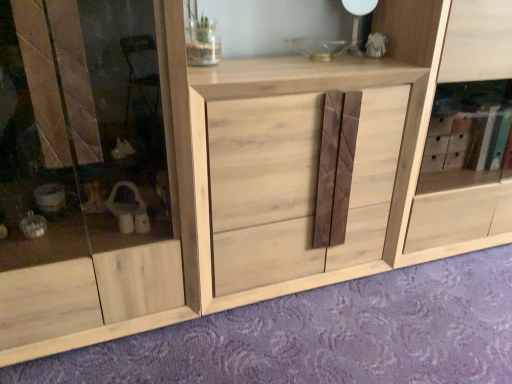
This screenshot has height=384, width=512. Identify the location of natural wood cabinet at center. (94, 177).

You are a GUI agent. You are given a task and a screenshot of the screen. Output one action in this format:
    pyautogui.click(x=<x>, y=<y>)
    Task: Click on the natural wood cabinet at center
    
    Given the screenshot: What is the action you would take?
    pyautogui.click(x=444, y=194)

This screenshot has height=384, width=512. What do you see at coordinates (294, 186) in the screenshot?
I see `natural wood drawer at center` at bounding box center [294, 186].

Where is `natural wood drawer at center`? Image resolution: width=512 pixels, height=384 pixels. natural wood drawer at center is located at coordinates (x=294, y=186).

The height and width of the screenshot is (384, 512). What are the coordinates of `natural wood cabinet at center` in the screenshot? It's located at (94, 177).

Which is more distant, [135,313] or [505,193]?

Positioned behind is point [505,193].

Who is smaller, natural wood cabinet at center or natural wood cabinet at center?

natural wood cabinet at center.

From the image's perspective, is natural wood cabinet at center on top of natural wood cabinet at center?

No, from the image's perspective, natural wood cabinet at center is not on top of natural wood cabinet at center.

Is natural wood cabinet at center turned away from natural wood cabinet at center?

natural wood cabinet at center does not have its back to natural wood cabinet at center.

Which is behind, natural wood cabinet at center or natural wood cabinet at center?

natural wood cabinet at center.

Does point (461, 203) lie in front of point (41, 259)?

No, it is not.

Is natural wood cabinet at center thinner than natural wood cabinet at center?

Correct, the width of natural wood cabinet at center is less than that of natural wood cabinet at center.

How many degrees apart are the facing directions of natural wood cabinet at center and natural wood cabinet at center?

There is a 0.00024-degree angle between the facing directions of natural wood cabinet at center and natural wood cabinet at center.

From a real-world perspective, does natural wood drawer at center stand above natural wood cabinet at center?

No.

Is natural wood drawer at center not within natural wood cabinet at center?

Indeed, natural wood drawer at center is completely outside natural wood cabinet at center.

Is natural wood drawer at center positioned behind natural wood cabinet at center?

No, it is not.

Can you tell me how much natural wood cabinet at center and natural wood drawer at center differ in facing direction?

The angular difference between natural wood cabinet at center and natural wood drawer at center is 7.16e-05 degrees.

Looking at this image, does natural wood cabinet at center come in front of natural wood drawer at center?

No, it is behind natural wood drawer at center.

Who is taller, natural wood cabinet at center or natural wood drawer at center?

Standing taller between the two is natural wood cabinet at center.

Is point (433, 79) in front of point (227, 247)?

Yes, point (433, 79) is closer to viewer.

From the image's perspective, relative to natural wood cabinet at center, is natural wood drawer at center above or below?

From the image's perspective, natural wood drawer at center appears above natural wood cabinet at center.

Can we say natural wood drawer at center lies outside natural wood cabinet at center?

Yes.

Looking at this image, from a real-world perspective, is natural wood drawer at center on natural wood cabinet at center?

No, from a real-world perspective, natural wood drawer at center is not on top of natural wood cabinet at center.

Considering the relative sizes of natural wood drawer at center and natural wood cabinet at center in the image provided, is natural wood drawer at center taller than natural wood cabinet at center?

No.

Is natural wood cabinet at center placed right next to natural wood drawer at center?

No, natural wood cabinet at center is not making contact with natural wood drawer at center.

In order to click on screen door on the left of natural wood drawer at center in this screenshot , I will do `click(94, 177)`.

Is natural wood cabinet at center oriented away from natural wood drawer at center?

natural wood cabinet at center does not have its back to natural wood drawer at center.

Image resolution: width=512 pixels, height=384 pixels. Identify the location of screen door below the natural wood cabinet at center (from a real-world perspective). (94, 177).

You are a GUI agent. You are given a task and a screenshot of the screen. Output one action in this format:
    pyautogui.click(x=<x>, y=<y>)
    Task: Click on the cabinet on the right of natural wood cabinet at center
    The width and height of the screenshot is (512, 384).
    Given the screenshot: What is the action you would take?
    pos(444,194)

Based on their spatial positions, is natural wood cabinet at center or natural wood drawer at center further from natural wood cabinet at center?

natural wood cabinet at center is further to natural wood cabinet at center.

Estimate the real-world distances between objects in this image. Which object is closer to natural wood cabinet at center, natural wood drawer at center or natural wood cabinet at center?

natural wood drawer at center.

Which object lies nearer to the anchor point natural wood drawer at center, natural wood cabinet at center or natural wood cabinet at center?

Among the two, natural wood cabinet at center is located nearer to natural wood drawer at center.

Considering their positions, is natural wood cabinet at center positioned closer to natural wood cabinet at center than natural wood drawer at center?

Based on the image, natural wood drawer at center appears to be nearer to natural wood cabinet at center.

Looking at the image, which one is located closer to natural wood drawer at center, natural wood cabinet at center or natural wood cabinet at center?

Based on the image, natural wood cabinet at center appears to be nearer to natural wood drawer at center.

Which object lies nearer to the anchor point natural wood cabinet at center, natural wood drawer at center or natural wood cabinet at center?

Among the two, natural wood drawer at center is located nearer to natural wood cabinet at center.

Identify the location of drawer between natural wood cabinet at center and natural wood cabinet at center from left to right. (294, 186).